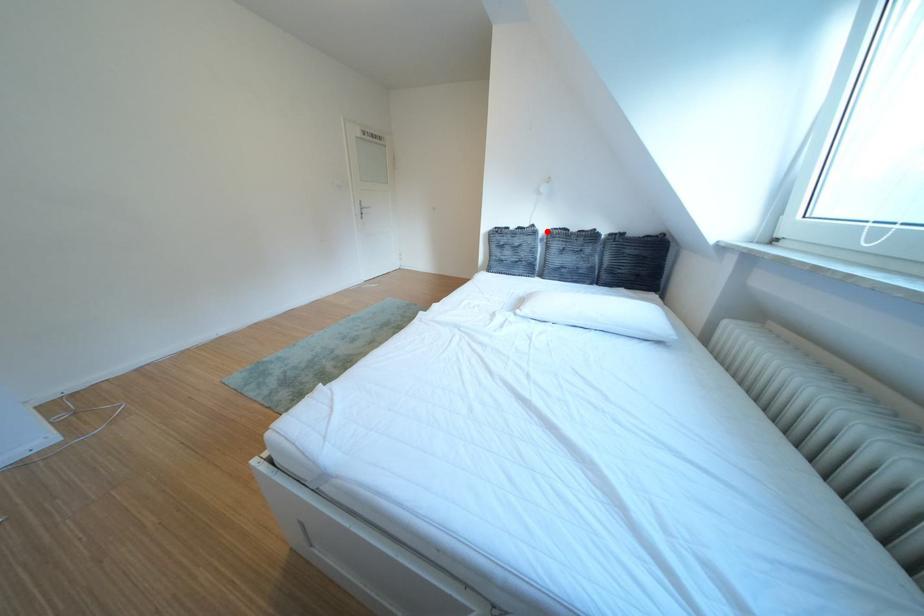
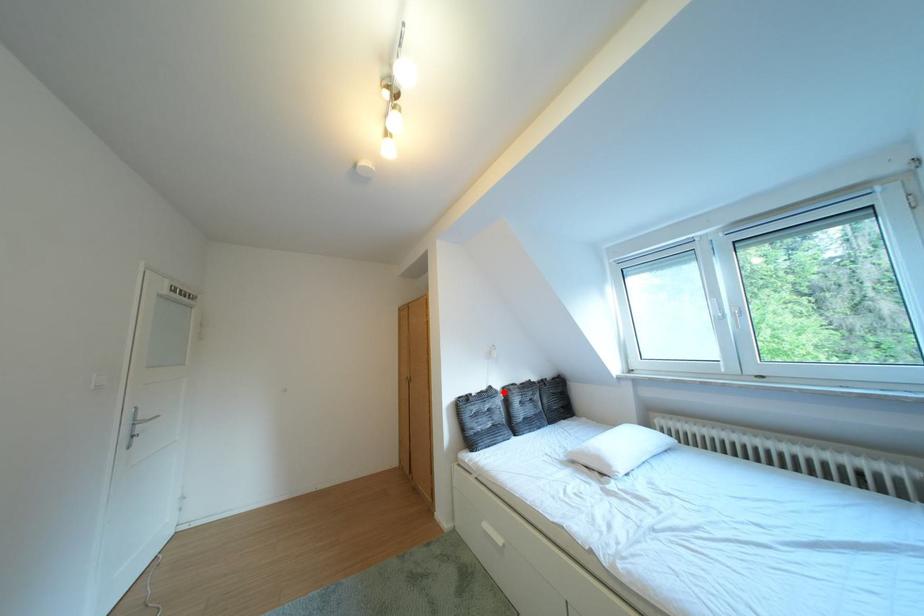
I am providing you with two images of the same scene from different viewpoints. A red point is marked on the first image and another point is marked on the second image. Is the marked point in image1 the same physical position as the marked point in image2?

Yes